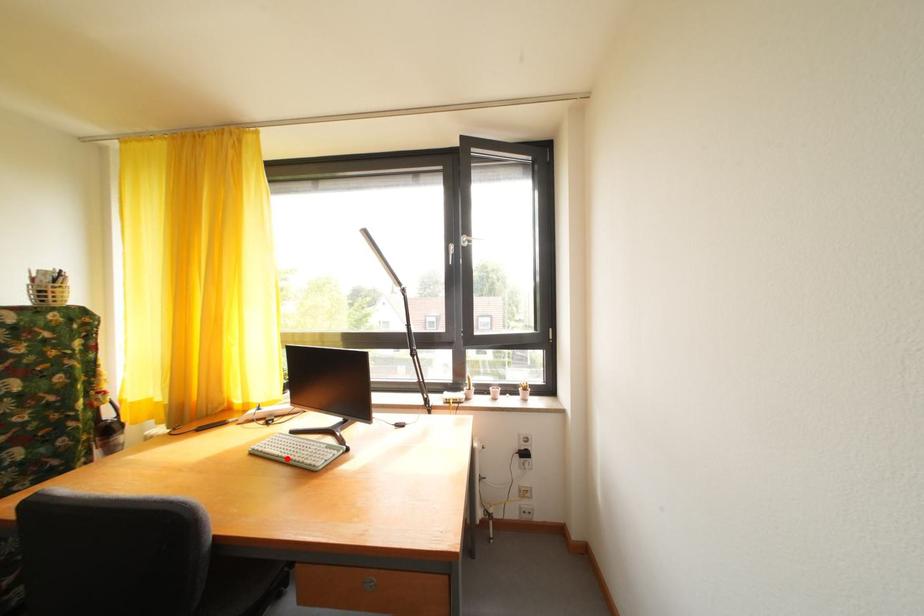
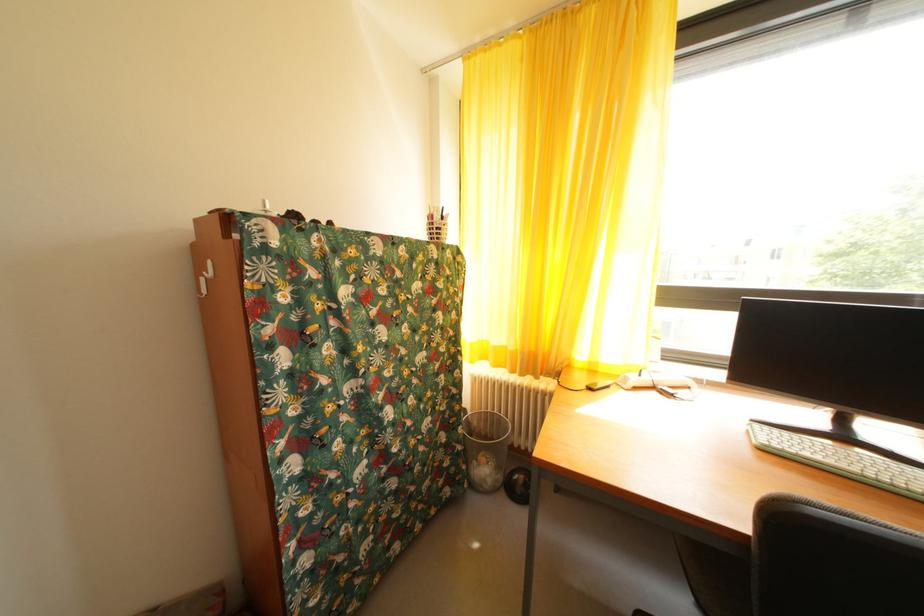
Locate, in the second image, the point that corresponds to the highlighted location in the first image.

(854, 472)